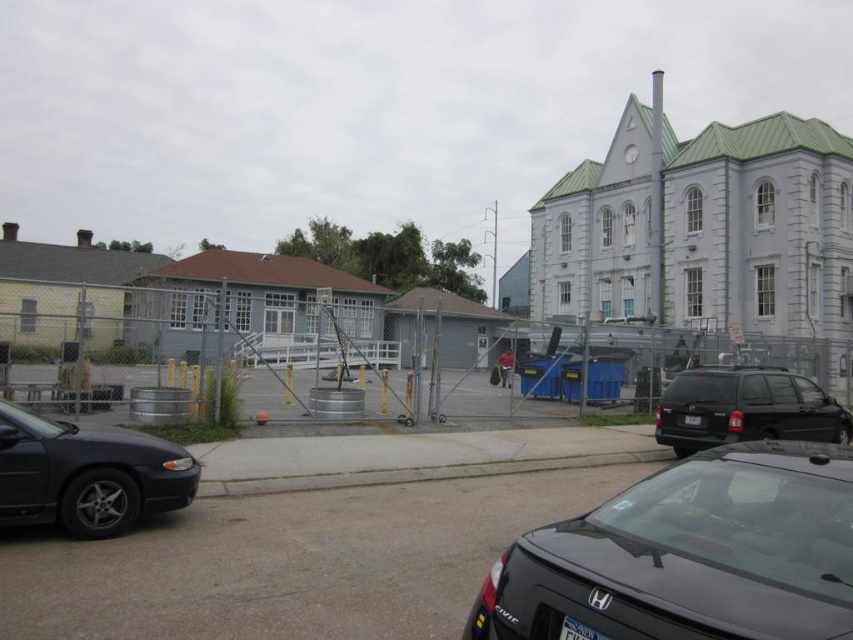
Question: Is black asphalt parking lot at center positioned at the back of shiny black sedan at left?

Choices:
 (A) yes
 (B) no

Answer: (A)

Question: Among these objects, which one is nearest to the camera?

Choices:
 (A) shiny black sedan at left
 (B) black matte honda civic at lower right

Answer: (B)

Question: Does white stone church at upper right come behind black matte van at center?

Choices:
 (A) yes
 (B) no

Answer: (A)

Question: Which object appears closest to the camera in this image?

Choices:
 (A) shiny black sedan at left
 (B) black matte honda civic at lower right
 (C) white stone church at upper right

Answer: (B)

Question: Which of the following is the closest to the observer?

Choices:
 (A) (788, 276)
 (B) (141, 609)

Answer: (B)

Question: Does shiny black sedan at left appear over black matte van at center?

Choices:
 (A) no
 (B) yes

Answer: (B)